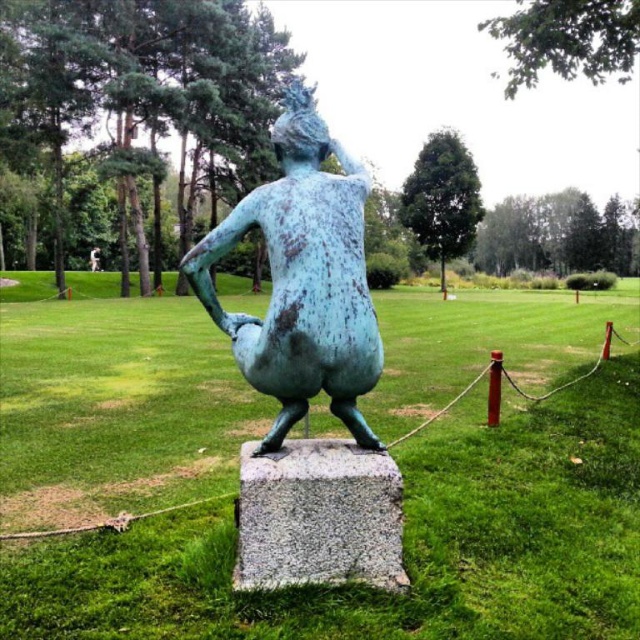
Question: Can you confirm if green patinated bronze statue at center is smaller than granite at center?

Choices:
 (A) no
 (B) yes

Answer: (A)

Question: Which point appears farthest from the camera in this image?

Choices:
 (A) (292, 376)
 (B) (163, 620)

Answer: (A)

Question: Is green patinated bronze statue at center smaller than green patina statue at center?

Choices:
 (A) no
 (B) yes

Answer: (A)

Question: Estimate the real-world distances between objects in this image. Which object is closer to the granite at center?

Choices:
 (A) green patinated bronze statue at center
 (B) green patina statue at center

Answer: (B)

Question: Does green patinated bronze statue at center have a smaller size compared to granite at center?

Choices:
 (A) no
 (B) yes

Answer: (A)

Question: Which object appears closest to the camera in this image?

Choices:
 (A) green patina statue at center
 (B) granite at center
 (C) green patinated bronze statue at center

Answer: (C)